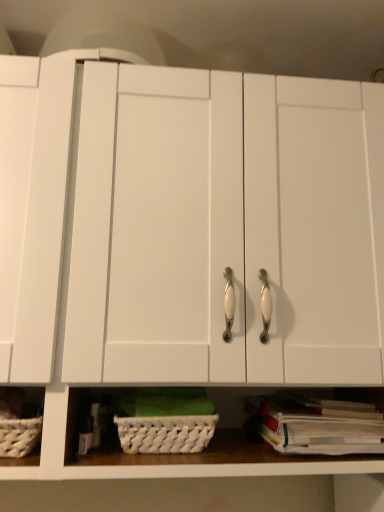
Question: Does white paper book at lower right touch white woven basket at lower center?

Choices:
 (A) no
 (B) yes

Answer: (A)

Question: Is white paper book at lower right positioned before white woven basket at lower center?

Choices:
 (A) yes
 (B) no

Answer: (A)

Question: Is white paper book at lower right surrounding white woven basket at lower center?

Choices:
 (A) no
 (B) yes

Answer: (A)

Question: Could you tell me if white paper book at lower right is facing white woven basket at lower center?

Choices:
 (A) yes
 (B) no

Answer: (B)

Question: Is white woven basket at lower center at the back of white paper book at lower right?

Choices:
 (A) yes
 (B) no

Answer: (B)

Question: From a real-world perspective, is white paper book at lower right under white woven basket at lower center?

Choices:
 (A) yes
 (B) no

Answer: (A)

Question: Considering the relative sizes of white woven basket at lower center and white paper book at lower right in the image provided, is white woven basket at lower center smaller than white paper book at lower right?

Choices:
 (A) no
 (B) yes

Answer: (B)

Question: Is white woven basket at lower center further to camera compared to white paper book at lower right?

Choices:
 (A) yes
 (B) no

Answer: (A)

Question: Is white paper book at lower right located within white woven basket at lower center?

Choices:
 (A) no
 (B) yes

Answer: (A)

Question: Is white woven basket at lower center not within white paper book at lower right?

Choices:
 (A) yes
 (B) no

Answer: (A)

Question: Is white woven basket at lower center touching white paper book at lower right?

Choices:
 (A) yes
 (B) no

Answer: (B)

Question: From a real-world perspective, is white woven basket at lower center positioned under white paper book at lower right based on gravity?

Choices:
 (A) no
 (B) yes

Answer: (A)

Question: Looking at their shapes, would you say white woven basket at lower center is wider or thinner than white paper book at lower right?

Choices:
 (A) wide
 (B) thin

Answer: (B)